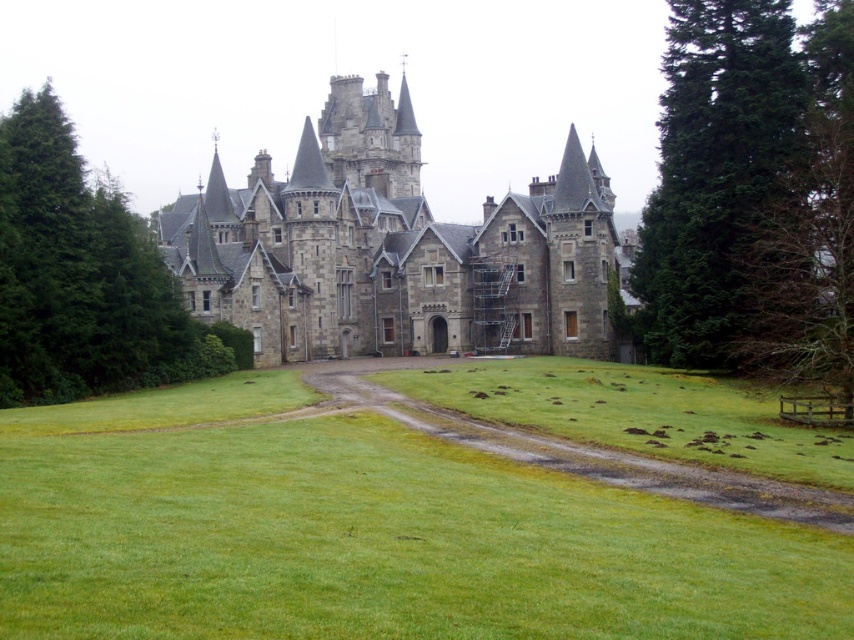
Question: Is gray stone castle at center to the right of green coniferous tree at right from the viewer's perspective?

Choices:
 (A) no
 (B) yes

Answer: (A)

Question: Which object is the closest to the gray stone castle at center?

Choices:
 (A) green coniferous tree at right
 (B) green leafy tree at left
 (C) green grass at center

Answer: (B)

Question: Which of the following is the closest to the observer?

Choices:
 (A) (208, 307)
 (B) (106, 250)
 (C) (313, 552)

Answer: (C)

Question: Does gray stone castle at center have a lesser width compared to green leafy tree at left?

Choices:
 (A) no
 (B) yes

Answer: (A)

Question: Is green coniferous tree at right closer to camera compared to green leafy tree at left?

Choices:
 (A) no
 (B) yes

Answer: (A)

Question: Which object is the farthest from the green leafy tree at left?

Choices:
 (A) green coniferous tree at right
 (B) gray stone castle at center
 (C) green grass at center

Answer: (A)